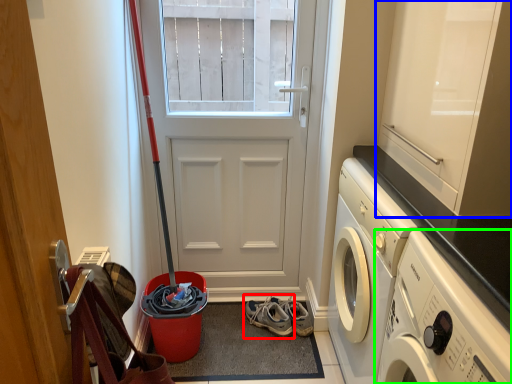
Question: Which is farther away from footwear (highlighted by a red box)? cabinetry (highlighted by a blue box) or washing machine (highlighted by a green box)?

Choices:
 (A) cabinetry
 (B) washing machine

Answer: (A)